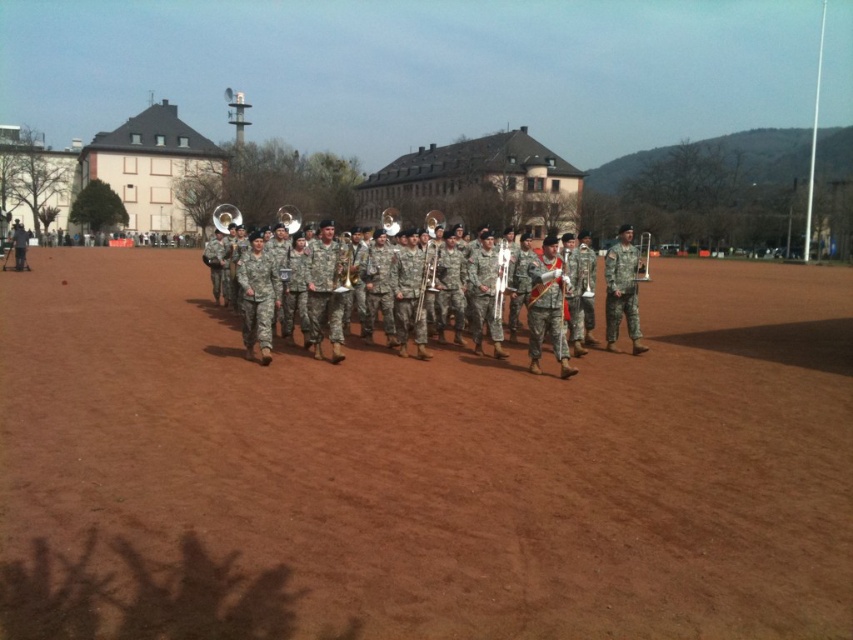
Is camouflage fabric band at center above silver metallic trombone at center?

Correct, camouflage fabric band at center is located above silver metallic trombone at center.

Is camouflage fabric band at center taller than silver metallic trombone at center?

Yes, camouflage fabric band at center is taller than silver metallic trombone at center.

What do you see at coordinates (553, 292) in the screenshot? I see `camouflage fabric band at center` at bounding box center [553, 292].

Find the location of a particular element. This screenshot has height=640, width=853. camouflage fabric band at center is located at coordinates (553, 292).

Between brown dirt field at center and camouflage fabric band at center, which one is positioned lower?

brown dirt field at center is lower down.

Does brown dirt field at center have a greater width compared to camouflage fabric band at center?

No, brown dirt field at center is not wider than camouflage fabric band at center.

Measure the distance between point [238,544] and camera.

Point [238,544] and camera are 13.90 feet apart.

In order to click on brown dirt field at center in this screenshot , I will do `click(421, 470)`.

Can you confirm if brown dirt field at center is positioned above silver metallic trombone at center?

Indeed, brown dirt field at center is positioned over silver metallic trombone at center.

Does brown dirt field at center have a larger size compared to silver metallic trombone at center?

Correct, brown dirt field at center is larger in size than silver metallic trombone at center.

You are a GUI agent. You are given a task and a screenshot of the screen. Output one action in this format:
    pyautogui.click(x=<x>, y=<y>)
    Task: Click on the brown dirt field at center
    This screenshot has width=853, height=640.
    Given the screenshot: What is the action you would take?
    pyautogui.click(x=421, y=470)